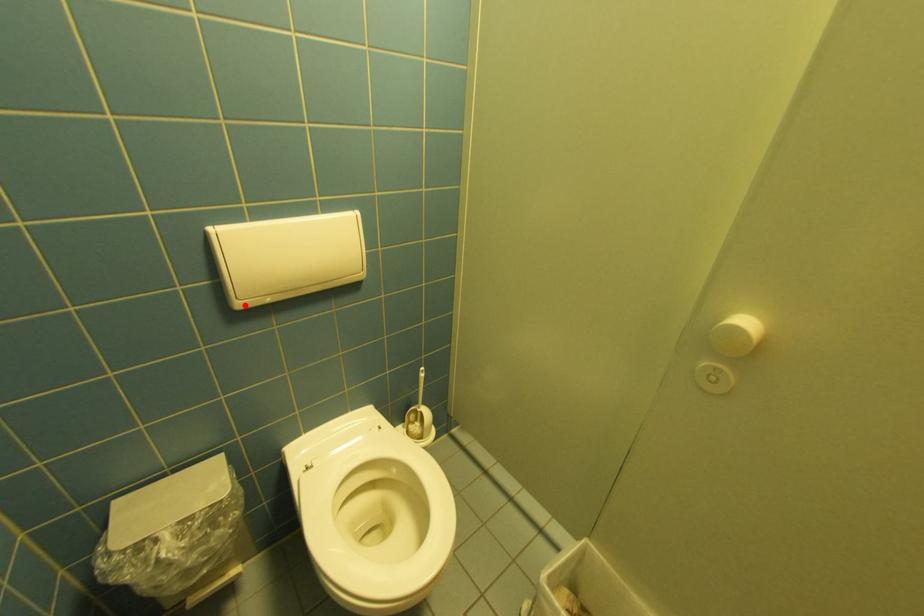
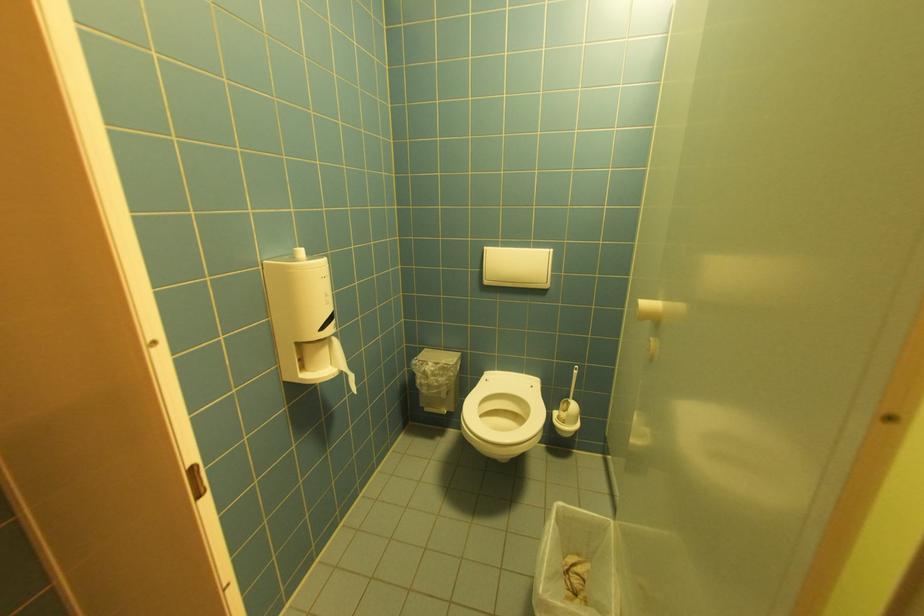
Question: I am providing you with two images of the same scene from different viewpoints. Given a red point in image1, look at the same physical point in image2. Is it:

Choices:
 (A) Closer to the viewpoint
 (B) Farther from the viewpoint

Answer: (B)